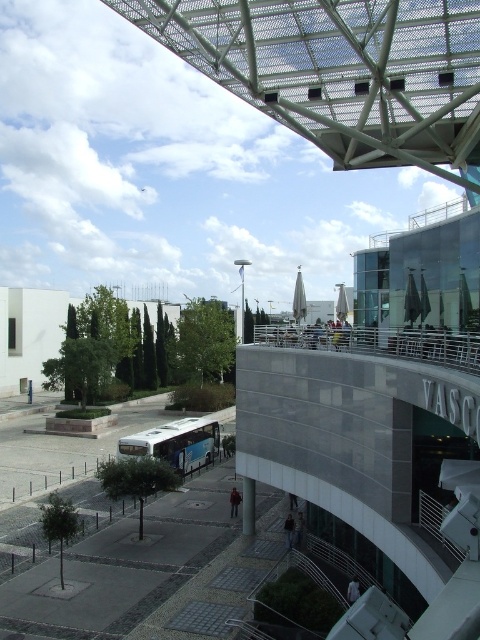
You are standing at the point marked by the coordinate point at point (175, 444). What object are you standing on?

You are standing on the blue metallic bus at center.

You are standing at the bus parked on the left side in the middle ground of the urban scene. You see two points marked in the image. Which point is closer to you, point 1 at coordinates [146,442] or point 2 at coordinates [243,508]?

Point 2 at coordinates [243,508] is closer to you because it is in front of point 1 at coordinates [146,442].

Looking at this image, you are standing at the entrance of the curved architectural structure with a glass facade and want to walk to the gray concrete pillar at lower center. Is the blue metallic bus at center blocking your path?

The blue metallic bus at center is further to the viewer than gray concrete pillar at lower center, so the bus is closer to you. This means the bus is blocking your path to the gray concrete pillar at lower center.